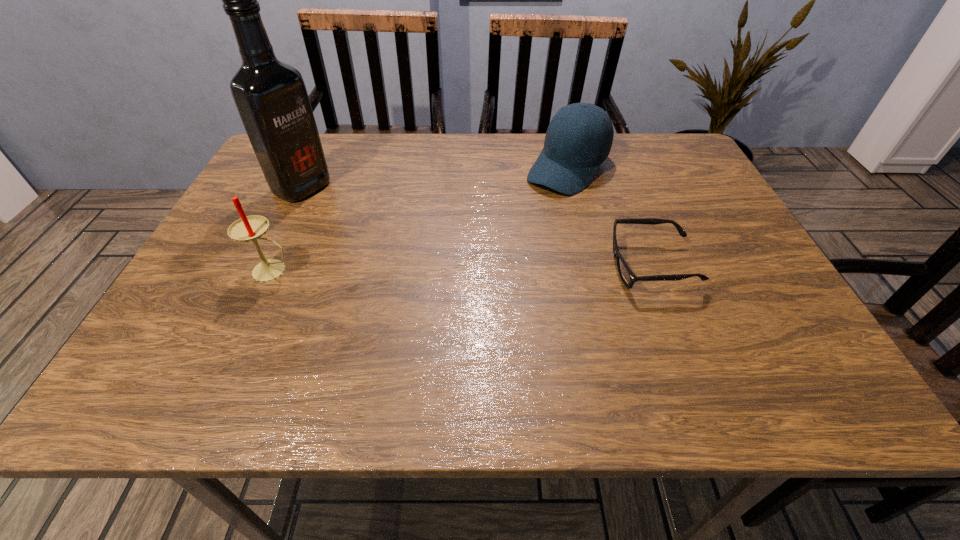
The width and height of the screenshot is (960, 540). What are the coordinates of `free spot on the desktop that is between the second tallest object and the sunglasses and is positioned on the front-facing side of the tallest object` in the screenshot? It's located at (476, 268).

You are a GUI agent. You are given a task and a screenshot of the screen. Output one action in this format:
    pyautogui.click(x=<x>, y=<y>)
    Task: Click on the vacant spot on the desktop that is between the third shortest object and the sunglasses and is positioned on the front-facing side of the baseball cap
    Image resolution: width=960 pixels, height=540 pixels.
    Given the screenshot: What is the action you would take?
    pyautogui.click(x=475, y=268)